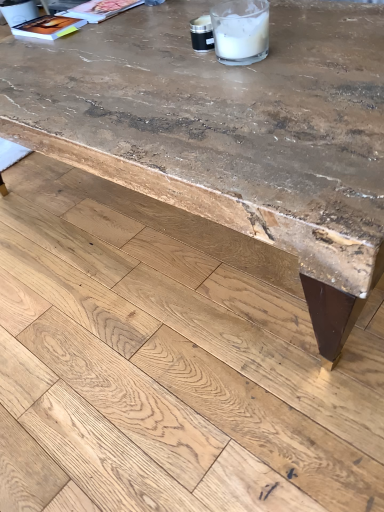
Locate an element on the screen. free point below matte paper magazine at upper left, which is counted as the 1th magazine, starting from the left (from a real-world perspective) is located at coordinates (44, 34).